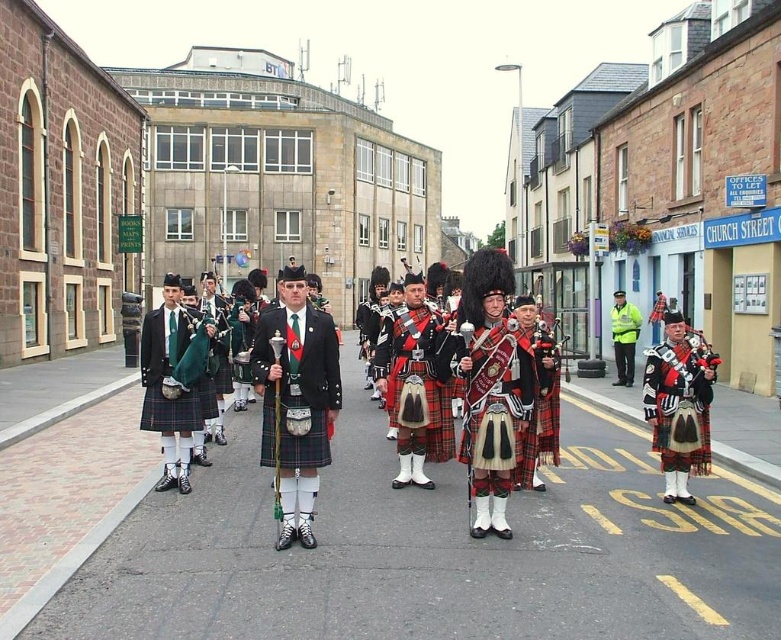
Question: Can you confirm if red plaid kilt at center is thinner than red tartan kilt at center?

Choices:
 (A) no
 (B) yes

Answer: (B)

Question: Is matte green tartan kilt at center smaller than matte green bagpipe at center?

Choices:
 (A) yes
 (B) no

Answer: (B)

Question: Does red plaid kilt at center appear on the left side of yellow reflective jacket at center?

Choices:
 (A) yes
 (B) no

Answer: (A)

Question: Which point appears farthest from the camera in this image?

Choices:
 (A) (269, 339)
 (B) (632, 312)
 (C) (334, 371)
 (D) (152, 332)

Answer: (B)

Question: Which of these objects is positioned closest to the matte green bagpipe at center?

Choices:
 (A) matte green tartan kilt at center
 (B) red tartan kilt at center
 (C) red plaid kilt at center

Answer: (C)

Question: Which point appears farthest from the camera in this image?

Choices:
 (A) (180, 317)
 (B) (289, 429)

Answer: (A)